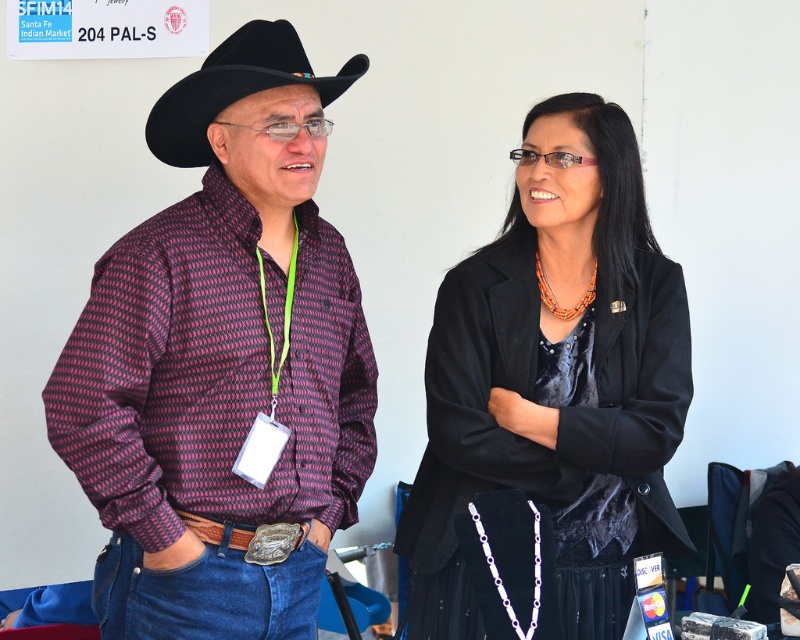
You are a photographer setting up for a portrait shoot. You notice the black velvet skirt at center and the black felt cowboy hat at upper left in the frame. Which object should you adjust to ensure both are equally visible to the viewer?

The black felt cowboy hat at upper left is further away from the viewer compared to the black velvet skirt at center. To make both equally visible, adjust the cowboy hat closer to the viewer or move the skirt further away.

You are organizing a costume party and need to decide which item takes up more space. Based on the image, which is larger between the plaid shirt at center and the black felt cowboy hat at upper left?

The plaid shirt at center is bigger than the black felt cowboy hat at upper left, so the plaid shirt at center takes up more space.

You are a photographer setting up for a portrait shoot. You need to ensure that the plaid shirt at center and the black felt cowboy hat at upper left are in focus. The camera you are using has a depth of field that can cover objects within a 10 inch range. Can both objects be in focus at the same time?

The plaid shirt at center is 9.62 inches away from the black felt cowboy hat at upper left. Since the distance between them is within the 10 inch range of the camera, both objects can be in focus simultaneously.